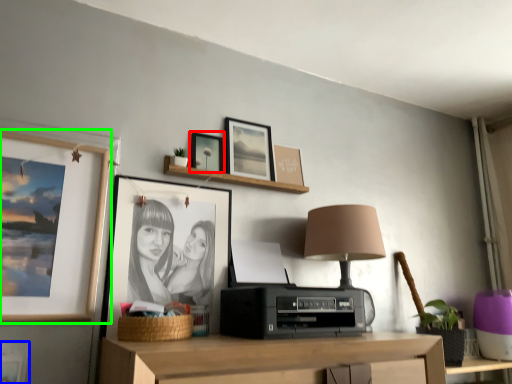
Question: Considering the real-world distances, which object is farthest from picture frame (highlighted by a red box)? picture frame (highlighted by a blue box) or picture frame (highlighted by a green box)?

Choices:
 (A) picture frame
 (B) picture frame

Answer: (A)